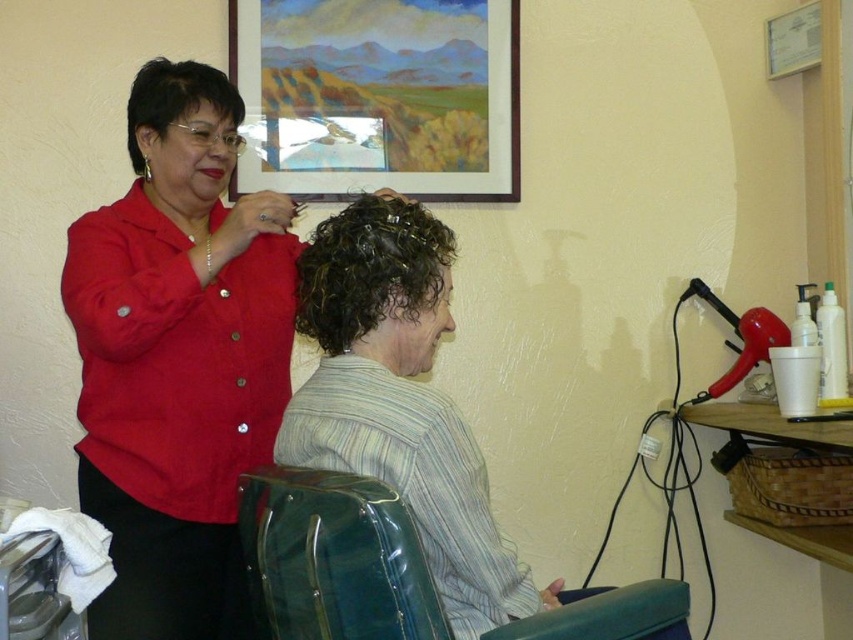
Looking at this image, does wooden-framed painting at upper center appear under matte black hair clip at upper left?

Incorrect, wooden-framed painting at upper center is not positioned below matte black hair clip at upper left.

Looking at this image, can you confirm if wooden-framed painting at upper center is positioned to the left of matte black hair clip at upper left?

Incorrect, wooden-framed painting at upper center is not on the left side of matte black hair clip at upper left.

Which is behind, point (347, 150) or point (190, 100)?

Point (347, 150)

Where is `wooden-framed painting at upper center`? wooden-framed painting at upper center is located at coordinates (376, 97).

Can you confirm if matte red blouse at upper left is positioned to the right of matte black hair clip at upper left?

Yes, matte red blouse at upper left is to the right of matte black hair clip at upper left.

Does matte red blouse at upper left appear over matte black hair clip at upper left?

Incorrect, matte red blouse at upper left is not positioned above matte black hair clip at upper left.

Measure the distance between point [294,273] and camera.

Point [294,273] and camera are 1.71 meters apart.

Identify the location of matte red blouse at upper left. The width and height of the screenshot is (853, 640). (178, 358).

Is striped fabric shirt at center wider than curly hair at center?

Indeed, striped fabric shirt at center has a greater width compared to curly hair at center.

Is point (318, 262) behind point (381, 300)?

That is True.

Where is `striped fabric shirt at center`? striped fabric shirt at center is located at coordinates (402, 403).